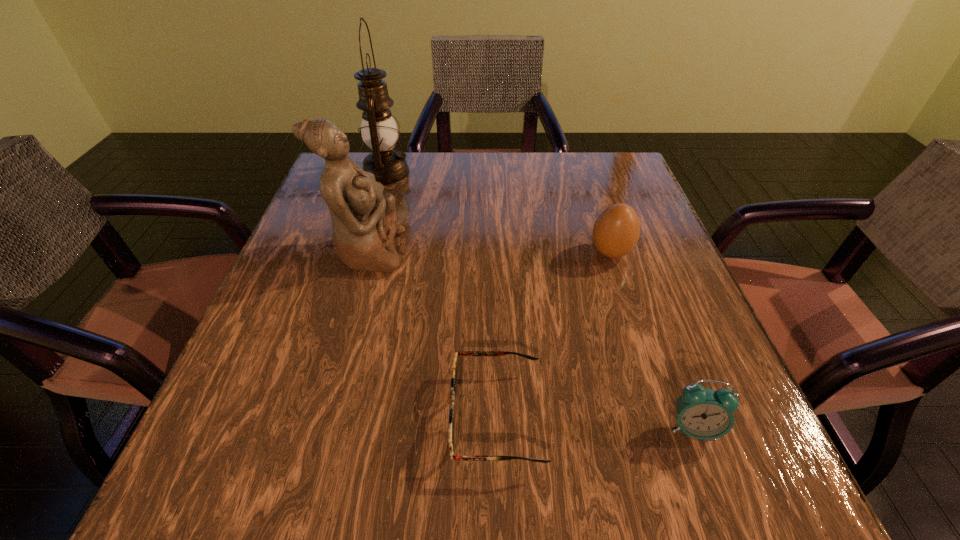
The width and height of the screenshot is (960, 540). I want to click on free space between the second shortest object and the boiled egg, so click(x=652, y=340).

The height and width of the screenshot is (540, 960). I want to click on free space between the boiled egg and the fourth tallest object, so pos(652,340).

The height and width of the screenshot is (540, 960). I want to click on empty space that is in between the fourth tallest object and the fourth shortest object, so click(530, 340).

This screenshot has height=540, width=960. I want to click on vacant space that's between the figurine and the boiled egg, so click(489, 252).

Locate an element on the screen. The image size is (960, 540). vacant area that lies between the boiled egg and the farthest object is located at coordinates (498, 213).

At what (x,y) coordinates should I click in order to perform the action: click on free space between the boiled egg and the spectacles. Please return your answer as a coordinate pair (x, y). This screenshot has width=960, height=540. Looking at the image, I should click on (553, 334).

Locate an element on the screen. the fourth closest object to the alarm clock is located at coordinates (379, 131).

Point out which object is positioned as the fourth nearest to the spectacles. Please provide its 2D coordinates. Your answer should be formatted as a tuple, i.e. [(x, y)], where the tuple contains the x and y coordinates of a point satisfying the conditions above.

[(379, 131)]

Locate an element on the screen. blank space that satisfies the following two spatial constraints: 1. on the front side of the boiled egg; 2. on the frame of the spectacles is located at coordinates pyautogui.click(x=663, y=416).

What are the coordinates of `free space that satisfies the following two spatial constraints: 1. on the front-facing side of the boiled egg; 2. on the right side of the figurine` in the screenshot? It's located at (367, 253).